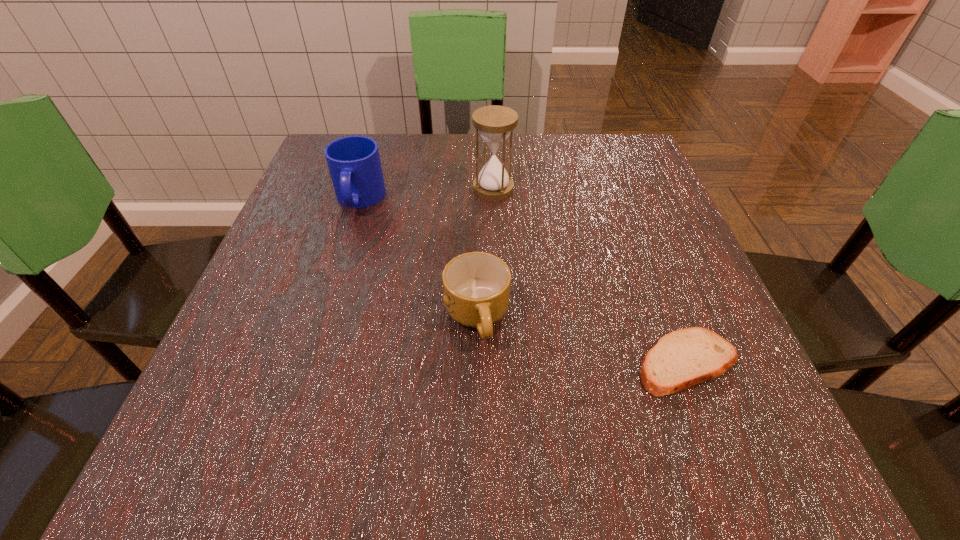
This screenshot has width=960, height=540. I want to click on free space at the near left corner of the desktop, so click(284, 489).

Identify the location of vacant region at the far right corner of the desktop. The width and height of the screenshot is (960, 540). (633, 141).

The width and height of the screenshot is (960, 540). In the image, there is a desktop. Find the location of `vacant space at the near right corner`. vacant space at the near right corner is located at coordinates (790, 468).

I want to click on free space between the third shortest object and the right mug, so click(419, 259).

Where is `free spot between the shortest object and the shorter mug`? free spot between the shortest object and the shorter mug is located at coordinates (582, 340).

The image size is (960, 540). In order to click on free point between the rightmost object and the left mug in this screenshot , I will do `click(523, 281)`.

I want to click on vacant area that lies between the nearer mug and the shortest object, so click(582, 340).

Locate an element on the screen. Image resolution: width=960 pixels, height=540 pixels. free space between the rightmost object and the farther mug is located at coordinates (523, 281).

I want to click on free area in between the left mug and the nearer mug, so click(x=419, y=259).

You are a GUI agent. You are given a task and a screenshot of the screen. Output one action in this format:
    pyautogui.click(x=<x>, y=<y>)
    Task: Click on the vacant point located between the shortest object and the nearer mug
    The height and width of the screenshot is (540, 960).
    Given the screenshot: What is the action you would take?
    pos(582,340)